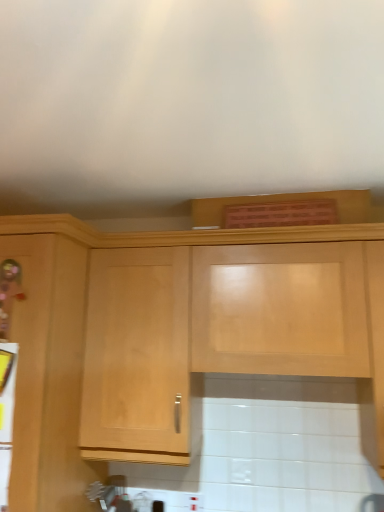
Question: Would you say metallic silver toaster at lower left is to the left or to the right of light wood cabinet at upper center in the picture?

Choices:
 (A) right
 (B) left

Answer: (B)

Question: Is metallic silver toaster at lower left bigger or smaller than light wood cabinet at upper center?

Choices:
 (A) small
 (B) big

Answer: (A)

Question: Is point (3, 500) positioned closer to the camera than point (21, 232)?

Choices:
 (A) farther
 (B) closer

Answer: (B)

Question: Is light wood cabinet at upper center wider or thinner than metallic silver toaster at lower left?

Choices:
 (A) wide
 (B) thin

Answer: (A)

Question: Is light wood cabinet at upper center spatially inside metallic silver toaster at lower left, or outside of it?

Choices:
 (A) inside
 (B) outside

Answer: (B)

Question: From the image's perspective, relative to metallic silver toaster at lower left, is light wood cabinet at upper center above or below?

Choices:
 (A) below
 (B) above

Answer: (B)

Question: Would you say light wood cabinet at upper center is to the left or to the right of metallic silver toaster at lower left in the picture?

Choices:
 (A) right
 (B) left

Answer: (A)